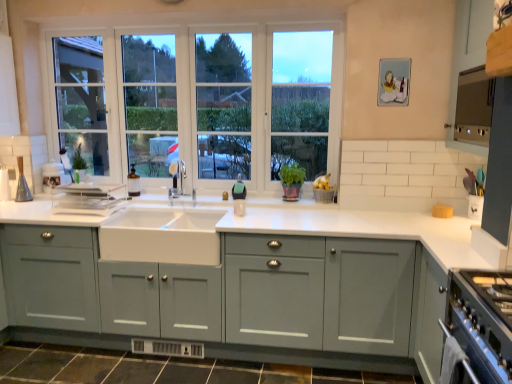
The width and height of the screenshot is (512, 384). What are the coordinates of `free space to the right of matte glass bottle at center` in the screenshot? It's located at (153, 199).